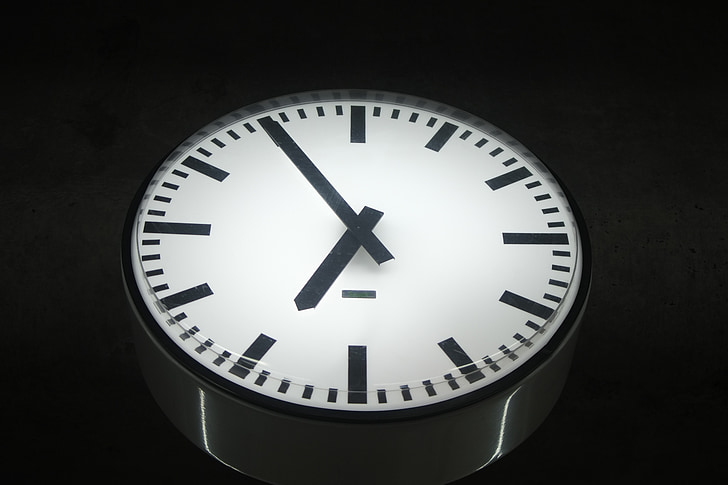
Image resolution: width=728 pixels, height=485 pixels. I want to click on clock cover, so click(137, 249), click(343, 93), click(440, 382), click(250, 361), click(577, 252).